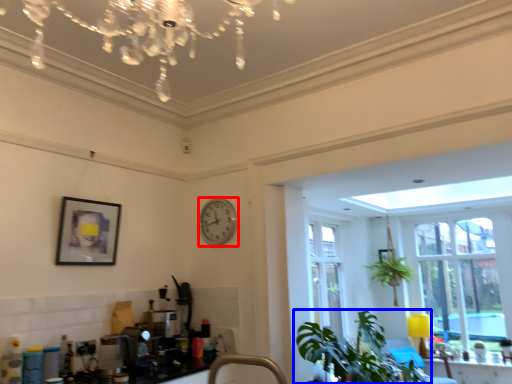
Question: Which of the following is the farthest to the observer, clock (highlighted by a red box) or houseplant (highlighted by a blue box)?

Choices:
 (A) clock
 (B) houseplant

Answer: (A)